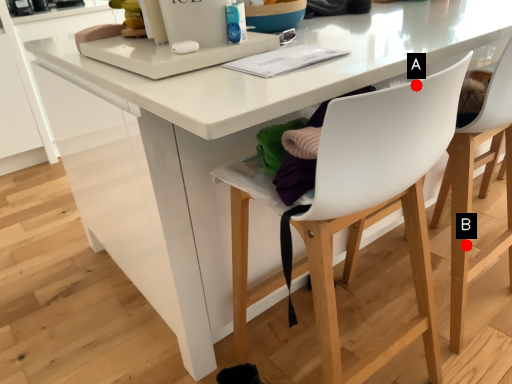
Question: Two points are circled on the image, labeled by A and B beside each circle. Among these points, which one is nearest to the camera?

Choices:
 (A) A is closer
 (B) B is closer

Answer: (A)